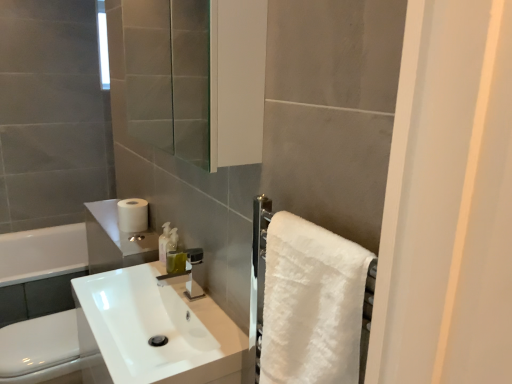
Find the location of `free space above white glossy toilet bowl at lower left (from a real-world perspective)`. free space above white glossy toilet bowl at lower left (from a real-world perspective) is located at coordinates (34, 329).